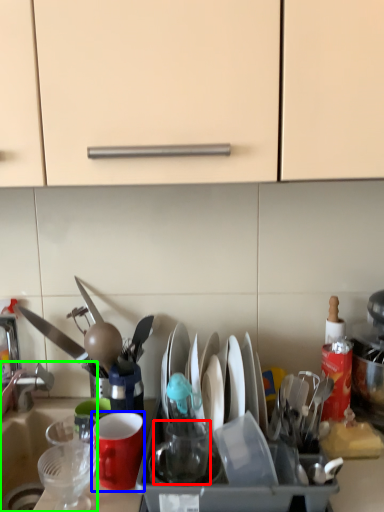
Question: Considering the real-world distances, which object is farthest from tableware (highlighted by a red box)? coffee cup (highlighted by a blue box) or sink (highlighted by a green box)?

Choices:
 (A) coffee cup
 (B) sink

Answer: (B)